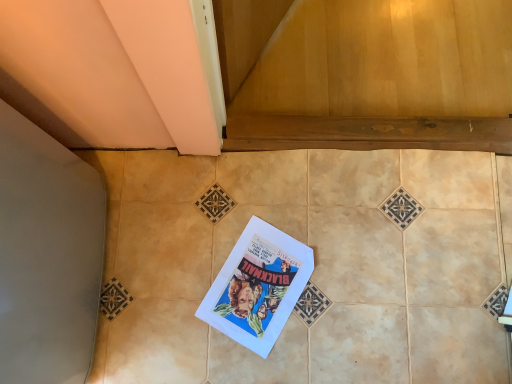
The height and width of the screenshot is (384, 512). What are the coordinates of `vacant space situated on the left part of white paper comic book at center` in the screenshot? It's located at (176, 278).